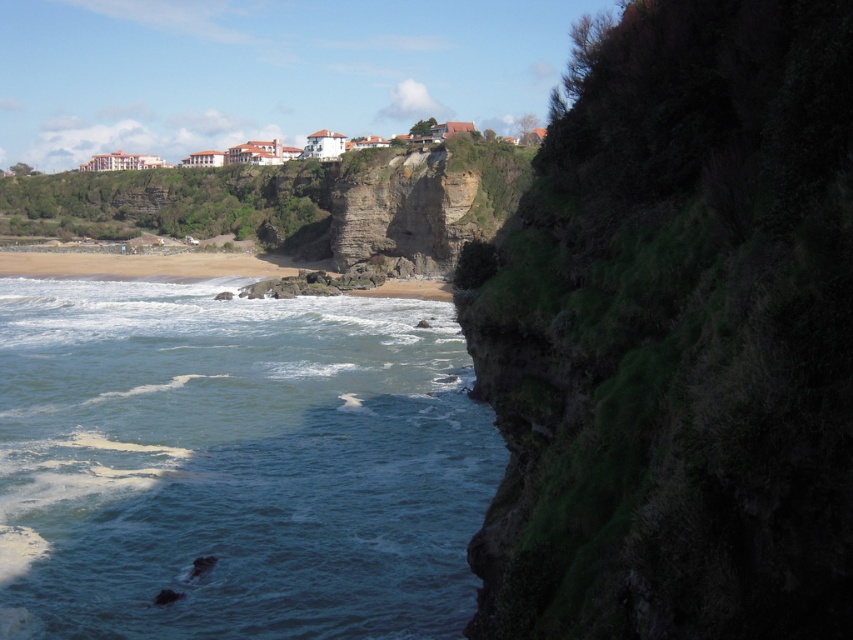
Looking at this image, which of these two, green mossy rock at upper center or blue water at lower left, stands taller?

green mossy rock at upper center

Is green mossy rock at upper center to the left of blue water at lower left from the viewer's perspective?

No, green mossy rock at upper center is not to the left of blue water at lower left.

Image resolution: width=853 pixels, height=640 pixels. I want to click on green mossy rock at upper center, so click(x=675, y=336).

The image size is (853, 640). In order to click on green mossy rock at upper center in this screenshot , I will do `click(675, 336)`.